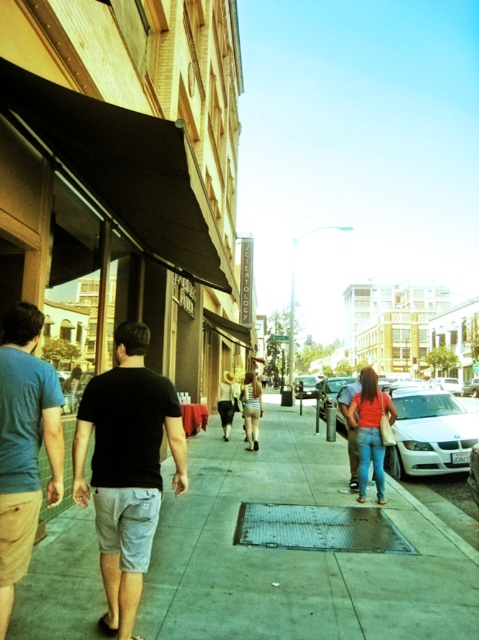
Question: Among these objects, which one is farthest from the camera?

Choices:
 (A) striped fabric dress at center
 (B) concrete sidewalk at center
 (C) metallic silver sedan at center
 (D) white glossy sedan at center

Answer: (C)

Question: Is matte blue t-shirt at left closer to camera compared to striped fabric dress at center?

Choices:
 (A) no
 (B) yes

Answer: (B)

Question: Among these objects, which one is farthest from the camera?

Choices:
 (A) striped fabric dress at center
 (B) black cotton t-shirt at center
 (C) matte blue t-shirt at left
 (D) metallic silver sedan at center

Answer: (D)

Question: Is black cotton t-shirt at center further to camera compared to metallic silver sedan at center?

Choices:
 (A) no
 (B) yes

Answer: (A)

Question: Which is nearer to the black cotton t-shirt at center?

Choices:
 (A) striped fabric dress at center
 (B) matte blue t-shirt at left
 (C) metallic silver sedan at center

Answer: (B)

Question: Can you confirm if concrete sidewalk at center is thinner than metallic silver sedan at center?

Choices:
 (A) no
 (B) yes

Answer: (A)